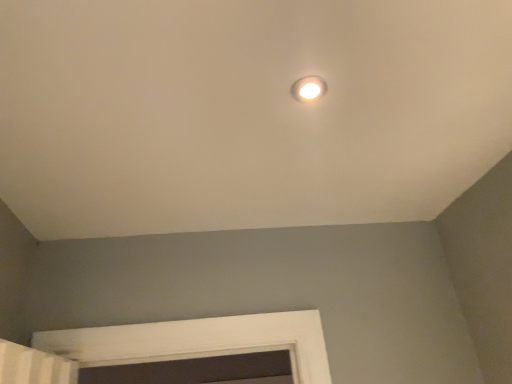
Image resolution: width=512 pixels, height=384 pixels. Describe the element at coordinates (308, 88) in the screenshot. I see `white glossy droplight at center` at that location.

Find the location of a particular element. The image size is (512, 384). white glossy droplight at center is located at coordinates (308, 88).

Identify the location of white glossy droplight at center. (308, 88).